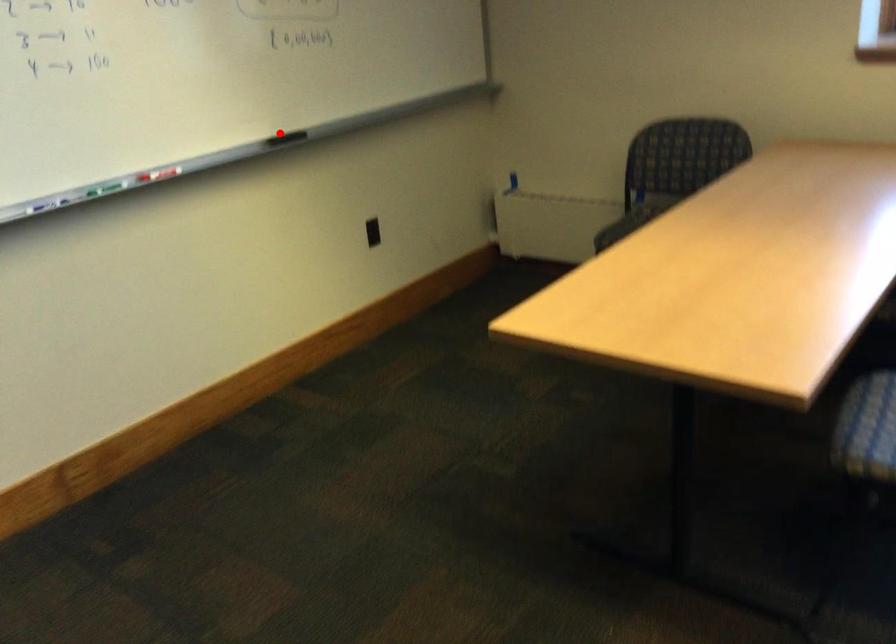
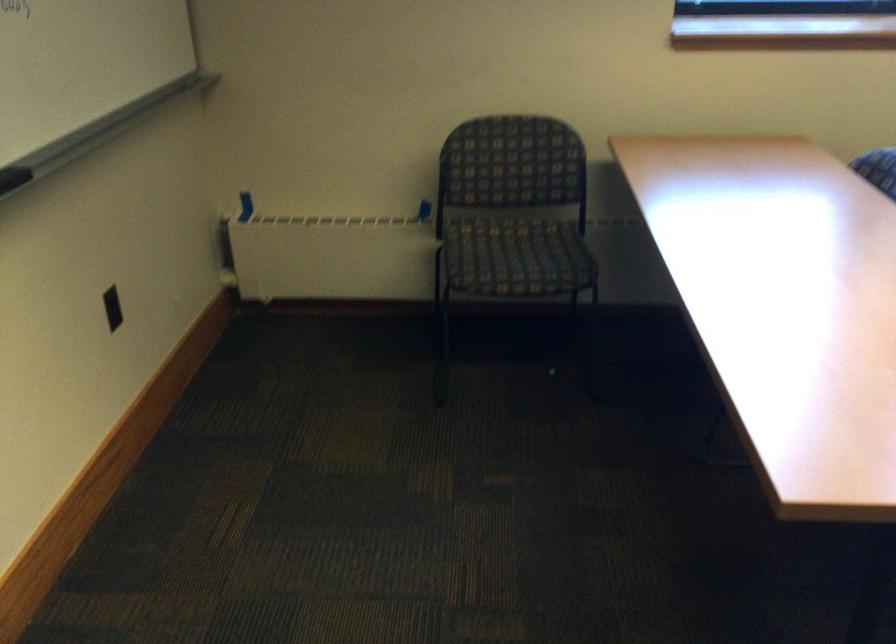
Where in the second image is the point corresponding to the highlighted location from the first image?

(13, 178)